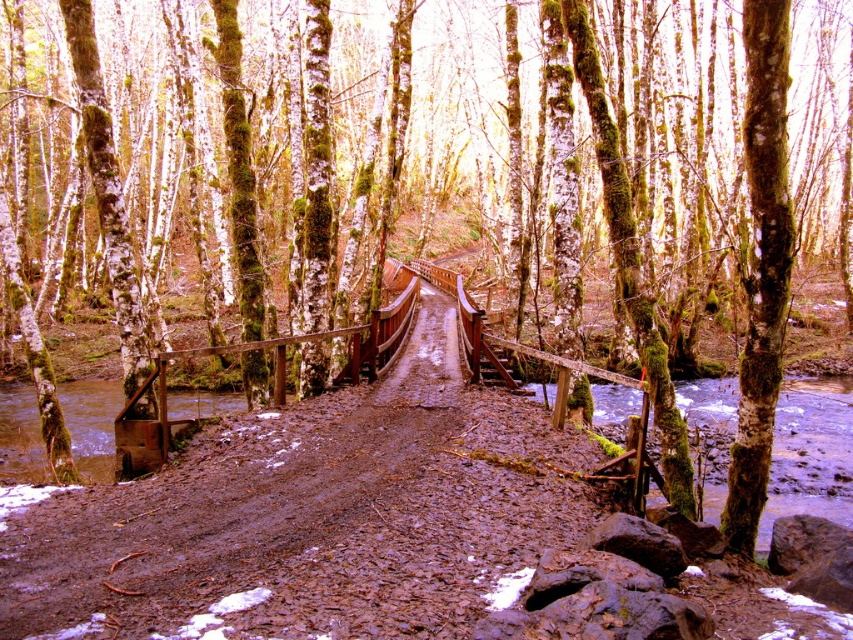
Question: Is brown textured dirt track at center wider than clear water at lower right?

Choices:
 (A) no
 (B) yes

Answer: (A)

Question: Which of the following is the farthest from the observer?

Choices:
 (A) (840, 483)
 (B) (308, 509)

Answer: (A)

Question: Which point is farther to the camera?

Choices:
 (A) brown textured dirt track at center
 (B) clear water at lower right

Answer: (B)

Question: Does brown textured dirt track at center appear over clear water at lower right?

Choices:
 (A) yes
 (B) no

Answer: (A)

Question: Does brown textured dirt track at center appear over clear water at lower right?

Choices:
 (A) no
 (B) yes

Answer: (B)